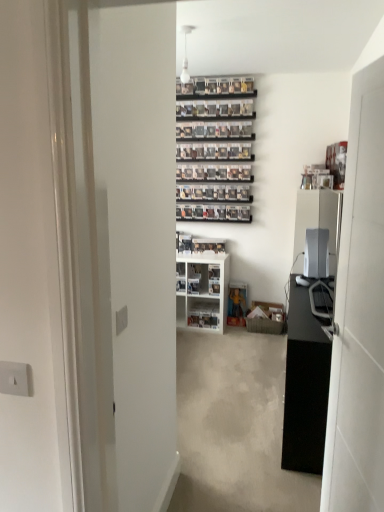
Question: Would you say white glossy cabinet at center is inside or outside white glossy shelf at center?

Choices:
 (A) outside
 (B) inside

Answer: (A)

Question: Is white glossy cabinet at center wider or thinner than white glossy shelf at center?

Choices:
 (A) thin
 (B) wide

Answer: (B)

Question: Which object is positioned closest to the satin silver monitor at right?

Choices:
 (A) black glossy desk at right
 (B) white glossy door at right
 (C) white glossy cabinet at center
 (D) white glossy shelf at center

Answer: (A)

Question: Estimate the real-world distances between objects in this image. Which object is farther from the satin silver monitor at right?

Choices:
 (A) white glossy door at right
 (B) black glossy desk at right
 (C) white glossy shelf at center
 (D) white glossy cabinet at center

Answer: (A)